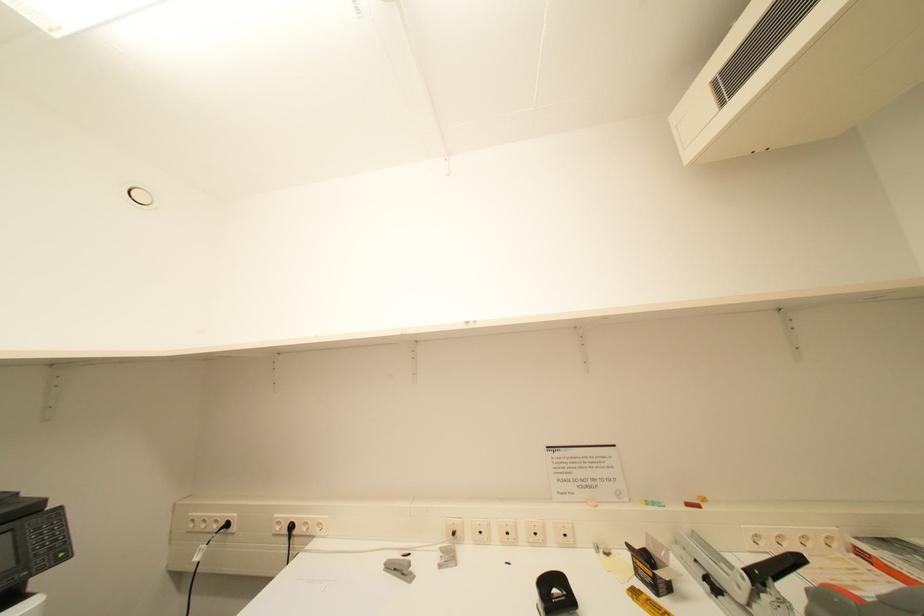
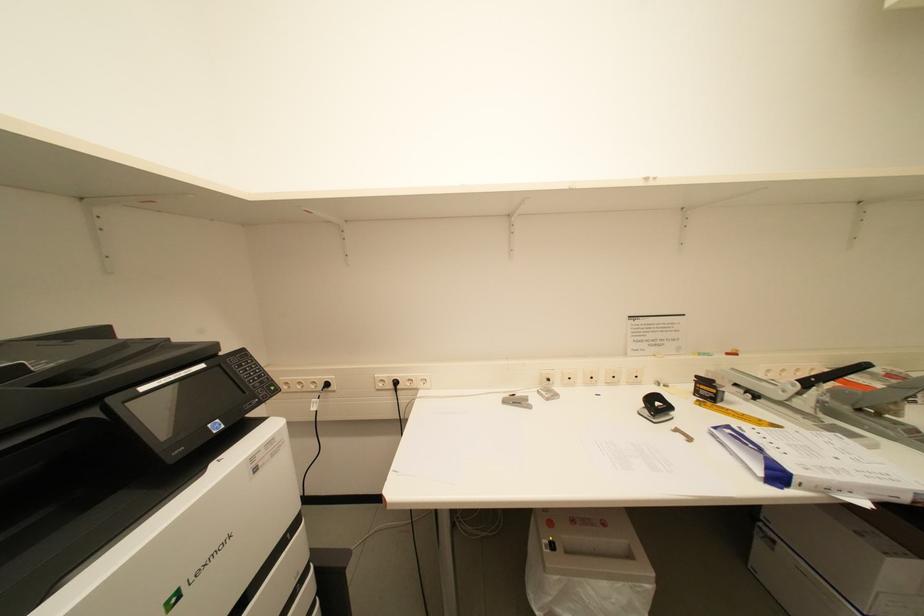
Question: The images are taken continuously from a first-person perspective. In which direction is your viewpoint rotating?

Choices:
 (A) Left
 (B) Right
 (C) Up
 (D) Down

Answer: (D)